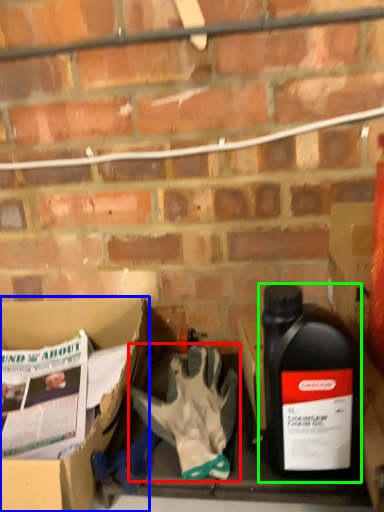
Question: Which object is positioned closest to glove (highlighted by a red box)? Select from box (highlighted by a blue box) and bottle (highlighted by a green box).

Choices:
 (A) box
 (B) bottle

Answer: (B)